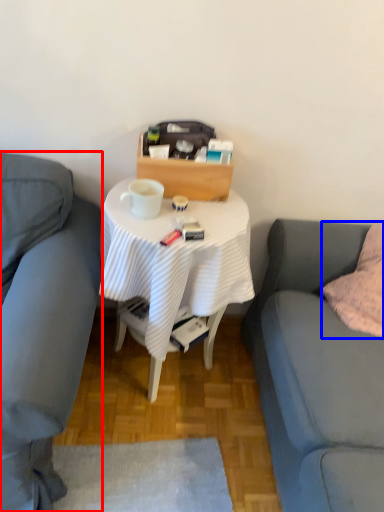
Question: Which object is closer to the camera taking this photo, studio couch (highlighted by a red box) or pillow (highlighted by a blue box)?

Choices:
 (A) studio couch
 (B) pillow

Answer: (A)